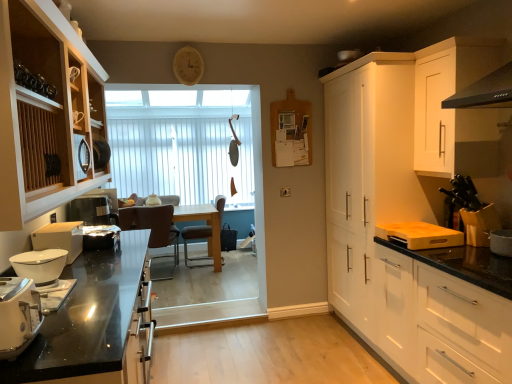
Question: From the image's perspective, is white matte cabinet at upper right, acting as the 4th cabinetry starting from the left, above or below white matte cabinet at right, positioned as the 2th cabinetry in right-to-left order?

Choices:
 (A) above
 (B) below

Answer: (A)

Question: Is white matte cabinet at upper right, which is counted as the 1th cabinetry, starting from the right, to the left or to the right of white matte cabinet at right, positioned as the 3th cabinetry in left-to-right order, in the image?

Choices:
 (A) left
 (B) right

Answer: (B)

Question: Estimate the real-world distances between objects in this image. Which object is closer to the white matte cabinet at right, which ranks as the third cabinetry in right-to-left order?

Choices:
 (A) white matte cabinet at upper right, acting as the 4th cabinetry starting from the left
 (B) white glossy bowl at left, arranged as the second kitchen appliance when viewed from the back
 (C) white plastic toaster at lower left, the 3th kitchen appliance in the back-to-front sequence
 (D) white ceramic pot at right, arranged as the first appliance when viewed from the right
 (E) brown leather chair at center

Answer: (A)

Question: Which of these objects is positioned closest to the white plastic toaster at lower left, the 3th kitchen appliance in the back-to-front sequence?

Choices:
 (A) white ceramic pot at right, which is the 2th appliance from left to right
 (B) white glossy bowl at left, positioned as the 1th kitchen appliance in back-to-front order
 (C) white matte cabinet at upper right, which is counted as the 1th cabinetry, starting from the right
 (D) white matte cabinet at right, positioned as the 2th cabinetry in right-to-left order
 (E) white vertical blinds at center

Answer: (B)